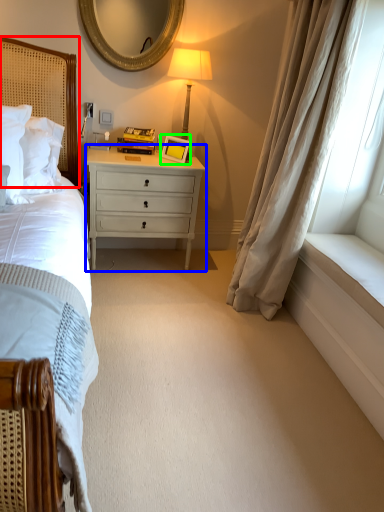
Question: Which object is the farthest from headboard (highlighted by a red box)? Choose among these: chest of drawers (highlighted by a blue box) or picture frame (highlighted by a green box).

Choices:
 (A) chest of drawers
 (B) picture frame

Answer: (B)